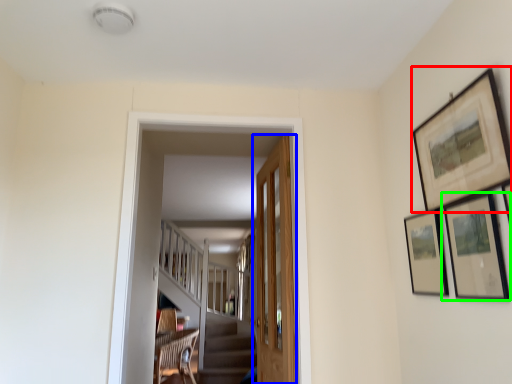
Question: Estimate the real-world distances between objects in this image. Which object is farther from picture frame (highlighted by a red box), door (highlighted by a blue box) or picture frame (highlighted by a green box)?

Choices:
 (A) door
 (B) picture frame

Answer: (A)